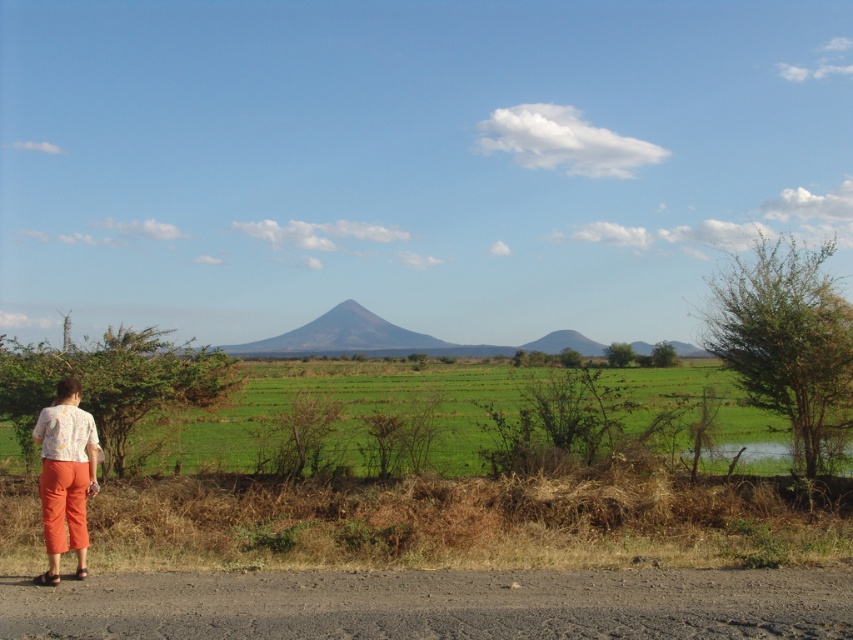
You are a photographer trying to capture a landscape shot. You have a green grassy field at center and a floral fabric blouse at lower left in your viewfinder. Which object should you focus on if you want to highlight something taller in the scene?

The green grassy field at center should be focused on because it has a greater height compared to the floral fabric blouse at lower left.

From the picture: You are standing at the point marked by point (x=430, y=420). What is the name of the object you are standing on?

You are standing on the green grassy field at center.